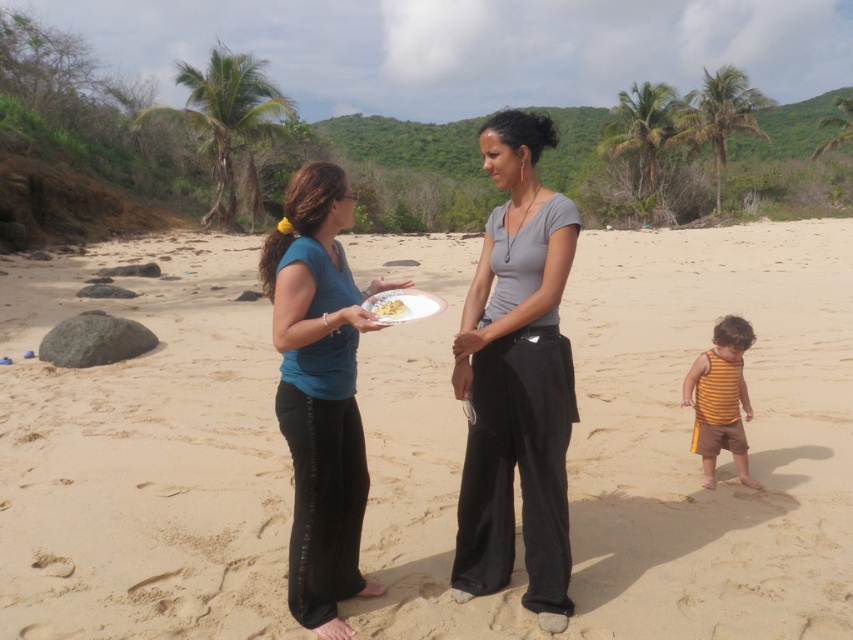
You are a photographer trying to capture a group photo of the gray matte shirt at center and the blue matte shirt at center. Based on their heights, which one should stand in the back to avoid blocking the other?

The gray matte shirt at center is much taller than the blue matte shirt at center, so the gray matte shirt at center should stand in the back to avoid blocking the shorter one.

You are a photographer trying to capture a photo of the blue matte shirt at center and the white matte plate at center. If you want to ensure both are fully visible in the frame, which object should you focus on to avoid cropping?

You should focus on the blue matte shirt at center because it might be wider than the white matte plate at center, so centering the shirt ensures the plate will also fit in the frame.

Consider the image. What is located at the coordinates point [515,380]?

The gray matte shirt at center is located at point [515,380].